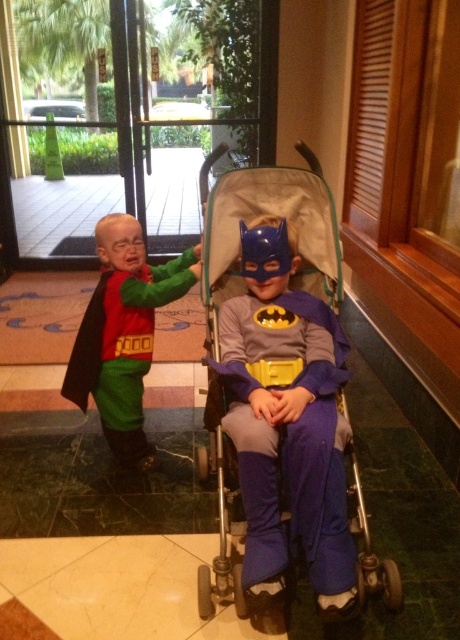
Based on the photo, between blue fabric stroller at center and blue fabric costume at center, which one has less height?

With less height is blue fabric costume at center.

Can you confirm if blue fabric stroller at center is shorter than blue fabric costume at center?

Incorrect, blue fabric stroller at center's height does not fall short of blue fabric costume at center's.

Does point (243, 586) come in front of point (260, 340)?

Yes.

The width and height of the screenshot is (460, 640). I want to click on blue fabric stroller at center, so click(283, 392).

Can you confirm if blue fabric stroller at center is taller than matte green pants at left?

Yes, blue fabric stroller at center is taller than matte green pants at left.

Locate an element on the screen. The height and width of the screenshot is (640, 460). blue fabric stroller at center is located at coordinates (283, 392).

The height and width of the screenshot is (640, 460). I want to click on blue fabric stroller at center, so click(283, 392).

Does blue fabric costume at center appear under matte green pants at left?

Yes.

Does blue fabric costume at center have a greater height compared to matte green pants at left?

No.

What are the coordinates of `blue fabric costume at center` in the screenshot? It's located at pos(289,436).